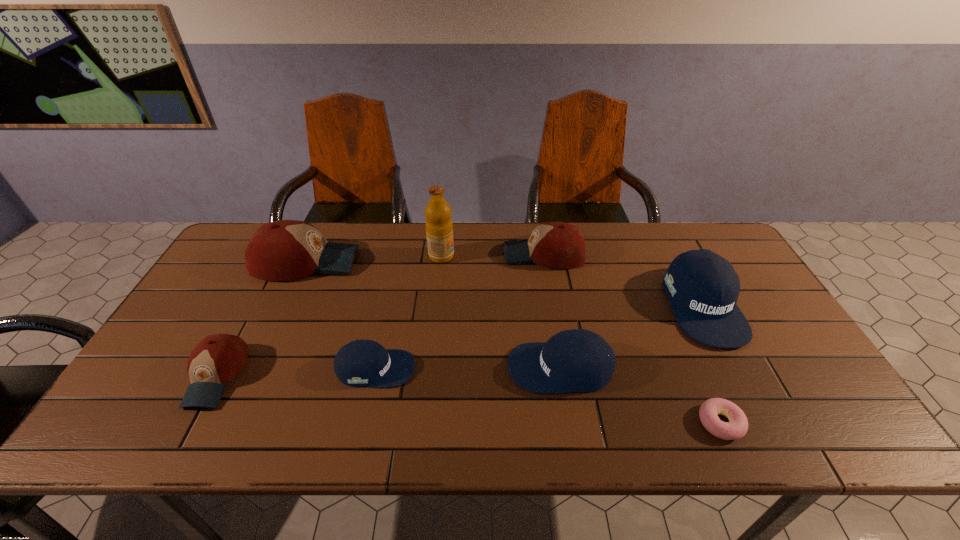
Locate an element on the screen. vacant point at the right edge is located at coordinates (754, 318).

The height and width of the screenshot is (540, 960). In the image, there is a desktop. Find the location of `vacant space at the far right corner`. vacant space at the far right corner is located at coordinates point(730,254).

At what (x,y) coordinates should I click in order to perform the action: click on free spot between the tallest object and the rightmost baseball cap. Please return your answer as a coordinate pair (x, y). Looking at the image, I should click on (572, 281).

Where is `vacant space in between the pink doughnut and the second blue baseball cap from left to right`? The width and height of the screenshot is (960, 540). vacant space in between the pink doughnut and the second blue baseball cap from left to right is located at coordinates 640,395.

Locate an element on the screen. free spot between the fourth baseball cap from right to left and the second smallest blue baseball cap is located at coordinates (468, 368).

Where is `vacant point located between the smallest red baseball cap and the smallest blue baseball cap`? vacant point located between the smallest red baseball cap and the smallest blue baseball cap is located at coordinates (296, 372).

Where is `vacant point located between the rightmost blue baseball cap and the fruit juice`? This screenshot has width=960, height=540. vacant point located between the rightmost blue baseball cap and the fruit juice is located at coordinates (572, 281).

Image resolution: width=960 pixels, height=540 pixels. What are the coordinates of `free space between the rightmost red baseball cap and the second blue baseball cap from right to left` in the screenshot? It's located at (552, 311).

Where is `free space between the doughnut and the nearest red baseball cap`? The width and height of the screenshot is (960, 540). free space between the doughnut and the nearest red baseball cap is located at coordinates (468, 399).

At what (x,y) coordinates should I click in order to perform the action: click on free space that is in between the fruit juice and the nearest red baseball cap. Please return your answer as a coordinate pair (x, y). Looking at the image, I should click on (329, 316).